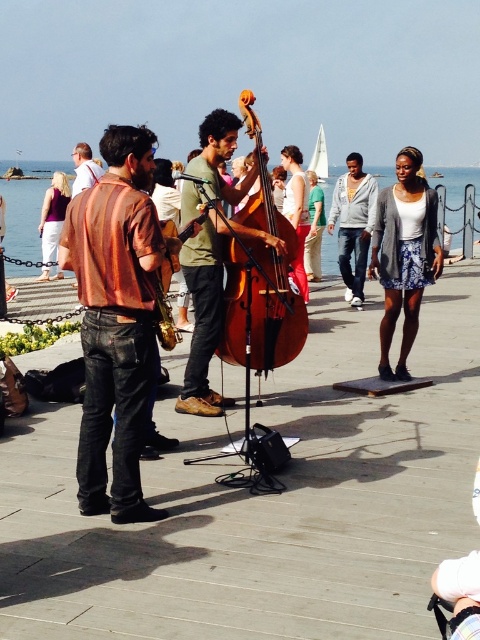
Question: Can you confirm if matte orange shirt at center is positioned below green matte shirt at center?

Choices:
 (A) no
 (B) yes

Answer: (B)

Question: Can you confirm if matte orange shirt at center is wider than green matte shirt at center?

Choices:
 (A) yes
 (B) no

Answer: (B)

Question: Which point is farther to the camera?

Choices:
 (A) (80, 180)
 (B) (299, 308)
 (C) (195, 356)
 (D) (96, 292)

Answer: (A)

Question: Based on their relative distances, which object is farther from the matte brown leather jacket at center?

Choices:
 (A) brown wooden cello at center
 (B) green matte shirt at center

Answer: (B)

Question: Which object is closer to the camera taking this photo?

Choices:
 (A) green matte shirt at center
 (B) matte brown leather jacket at center
 (C) matte orange shirt at center
 (D) brown wooden cello at center

Answer: (C)

Question: Can you confirm if brown wooden cello at center is positioned to the left of matte brown leather jacket at center?

Choices:
 (A) no
 (B) yes

Answer: (A)